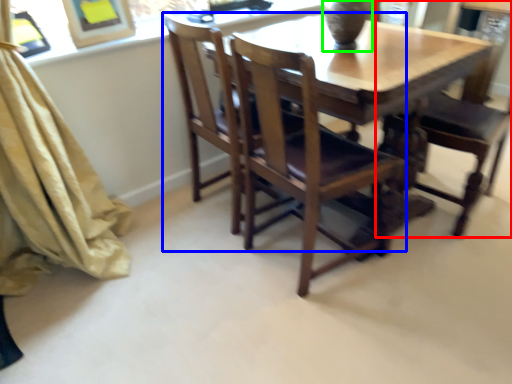
Question: Based on their relative distances, which object is farther from chair (highlighted by a red box)? Choose from chair (highlighted by a blue box) and glass vase (highlighted by a green box).

Choices:
 (A) chair
 (B) glass vase

Answer: (B)